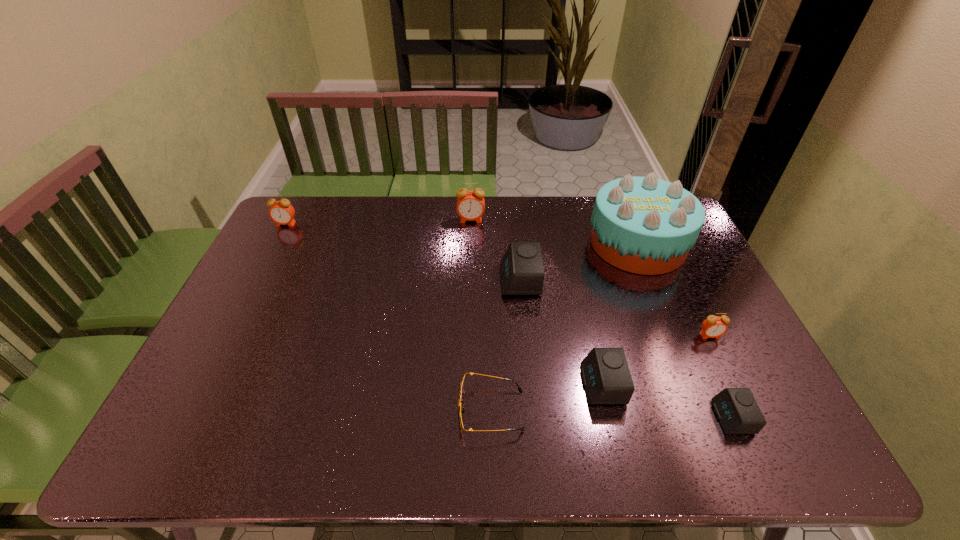
In the image, there is a desktop. Identify the location of vacant space at the left edge. The image size is (960, 540). (283, 271).

Where is `unoccupied position between the second pink alarm clock from left to right and the nearest pink alarm clock`? unoccupied position between the second pink alarm clock from left to right and the nearest pink alarm clock is located at coordinates (590, 278).

Locate an element on the screen. Image resolution: width=960 pixels, height=540 pixels. vacant space in between the sunglasses and the second black alarm clock from left to right is located at coordinates (547, 397).

Locate an element on the screen. This screenshot has width=960, height=540. vacant space in between the smallest black alarm clock and the rightmost pink alarm clock is located at coordinates click(x=721, y=376).

The width and height of the screenshot is (960, 540). I want to click on free spot between the farthest black alarm clock and the black sunglasses, so click(505, 345).

You are a GUI agent. You are given a task and a screenshot of the screen. Output one action in this format:
    pyautogui.click(x=<x>, y=<y>)
    Task: Click on the vacant region between the black sunglasses and the fourth nearest alarm clock
    The width and height of the screenshot is (960, 540).
    Given the screenshot: What is the action you would take?
    pyautogui.click(x=505, y=345)

Locate an element on the screen. This screenshot has width=960, height=540. vacant area between the shortest alarm clock and the second tallest object is located at coordinates (602, 319).

Image resolution: width=960 pixels, height=540 pixels. I want to click on vacant point located between the third tallest object and the rightmost black alarm clock, so click(509, 321).

Where is `free space between the leftmost pink alarm clock and the nearest pink alarm clock`? free space between the leftmost pink alarm clock and the nearest pink alarm clock is located at coordinates (498, 280).

The image size is (960, 540). Identify the location of empty location between the rightmost black alarm clock and the rightmost pink alarm clock. click(721, 376).